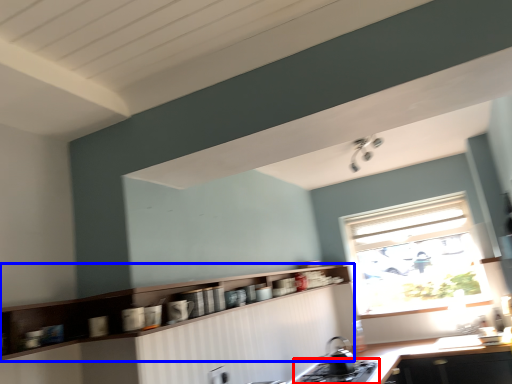
Question: Which object appears closest to the camera in this image, gas stove (highlighted by a red box) or cabinetry (highlighted by a blue box)?

Choices:
 (A) gas stove
 (B) cabinetry

Answer: (B)